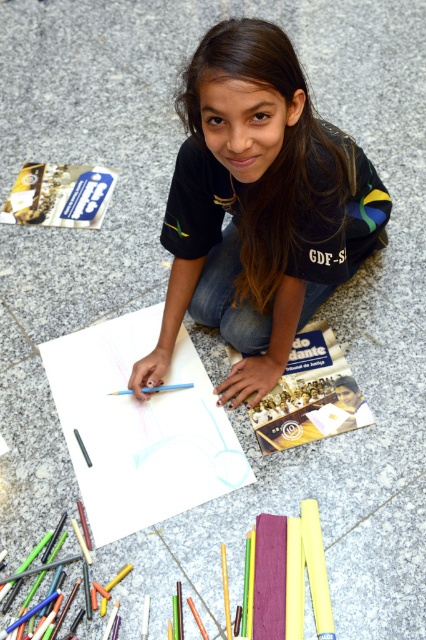
The girl is wearing a matte black shirt at center and has a white paper at center in front of her. Which object is taller?

The matte black shirt at center is taller than the white paper at center.

You are standing in front of the girl and want to pick up an object. There are two points marked in the scene. The first point is at coordinates point (x=296, y=168) and the second point is at coordinates point (x=88, y=420). Which point is closer to you?

Point (x=296, y=168) is closer to the viewer than point (x=88, y=420).